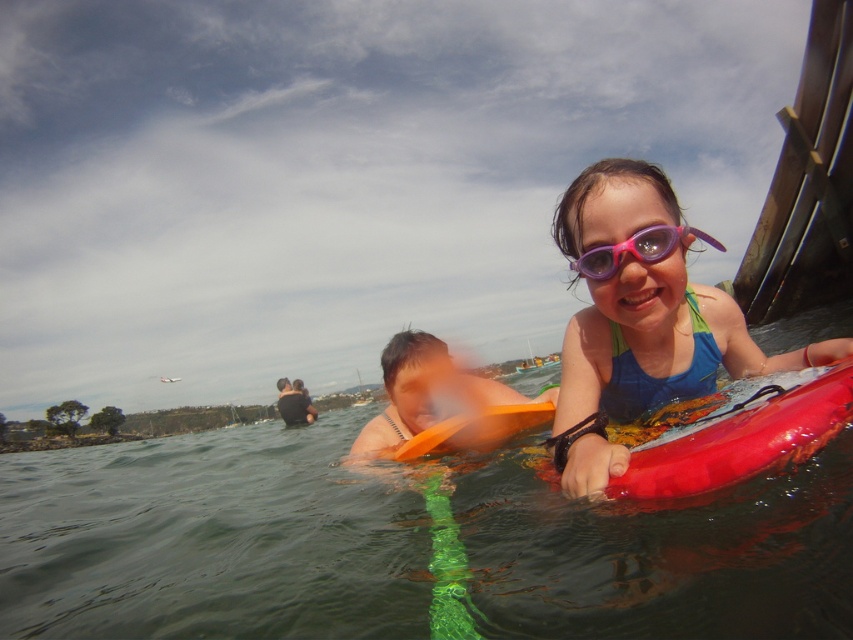
Can you confirm if rubberized red canoe at right is wider than orange foam paddle at center?

No, rubberized red canoe at right is not wider than orange foam paddle at center.

Between rubberized red canoe at right and orange foam paddle at center, which one has less height?

orange foam paddle at center is shorter.

What are the coordinates of `rubberized red canoe at right` in the screenshot? It's located at (740, 440).

This screenshot has height=640, width=853. What are the coordinates of `rubberized red canoe at right` in the screenshot? It's located at (740, 440).

Which is more to the right, blue fabric swimsuit at upper right or orange foam paddle at center?

From the viewer's perspective, blue fabric swimsuit at upper right appears more on the right side.

What do you see at coordinates (641, 320) in the screenshot? I see `blue fabric swimsuit at upper right` at bounding box center [641, 320].

Image resolution: width=853 pixels, height=640 pixels. I want to click on blue fabric swimsuit at upper right, so click(641, 320).

Can you confirm if blue fabric swimsuit at upper right is shorter than rubberized red canoe at right?

Incorrect, blue fabric swimsuit at upper right's height does not fall short of rubberized red canoe at right's.

Is point (601, 387) positioned after point (770, 456)?

Yes, it is.

Between point (645, 204) and point (543, 477), which one is positioned behind?

Positioned behind is point (543, 477).

Find the location of a particular element. Image resolution: width=853 pixels, height=640 pixels. blue fabric swimsuit at upper right is located at coordinates (641, 320).